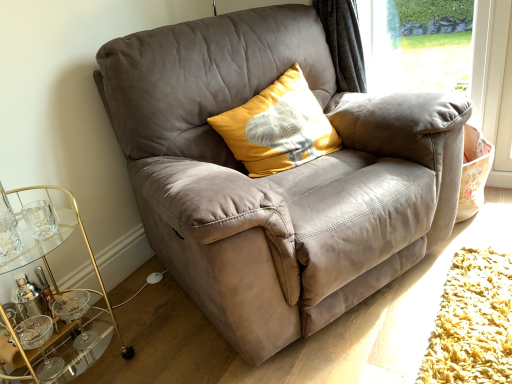
Question: Could you tell me if transparent glass window screen at upper right is facing suede gray chair at center?

Choices:
 (A) no
 (B) yes

Answer: (B)

Question: From a real-world perspective, is transparent glass window screen at upper right located beneath suede gray chair at center?

Choices:
 (A) no
 (B) yes

Answer: (A)

Question: Considering the relative positions of transparent glass window screen at upper right and suede gray chair at center in the image provided, is transparent glass window screen at upper right to the left of suede gray chair at center from the viewer's perspective?

Choices:
 (A) yes
 (B) no

Answer: (B)

Question: From the image's perspective, is transparent glass window screen at upper right over suede gray chair at center?

Choices:
 (A) no
 (B) yes

Answer: (B)

Question: Can you confirm if transparent glass window screen at upper right is shorter than suede gray chair at center?

Choices:
 (A) no
 (B) yes

Answer: (B)

Question: Looking at their shapes, would you say suede gray chair at center is wider or thinner than yellow textured cushion at center?

Choices:
 (A) thin
 (B) wide

Answer: (B)

Question: From the image's perspective, is suede gray chair at center above or below yellow textured cushion at center?

Choices:
 (A) above
 (B) below

Answer: (B)

Question: In terms of size, does suede gray chair at center appear bigger or smaller than yellow textured cushion at center?

Choices:
 (A) big
 (B) small

Answer: (A)

Question: Is suede gray chair at center taller or shorter than yellow textured cushion at center?

Choices:
 (A) short
 (B) tall

Answer: (B)

Question: From the image's perspective, relative to suede gray chair at center, is yellow textured cushion at center above or below?

Choices:
 (A) above
 (B) below

Answer: (A)

Question: Considering their positions, is yellow textured cushion at center located in front of or behind suede gray chair at center?

Choices:
 (A) front
 (B) behind

Answer: (B)

Question: From their relative heights in the image, would you say yellow textured cushion at center is taller or shorter than suede gray chair at center?

Choices:
 (A) tall
 (B) short

Answer: (B)

Question: Based on their positions, is yellow textured cushion at center located to the left or right of suede gray chair at center?

Choices:
 (A) right
 (B) left

Answer: (B)

Question: In the image, is transparent glass window screen at upper right positioned in front of or behind suede gray chair at center?

Choices:
 (A) behind
 (B) front

Answer: (A)

Question: Based on their sizes in the image, would you say transparent glass window screen at upper right is bigger or smaller than suede gray chair at center?

Choices:
 (A) small
 (B) big

Answer: (A)